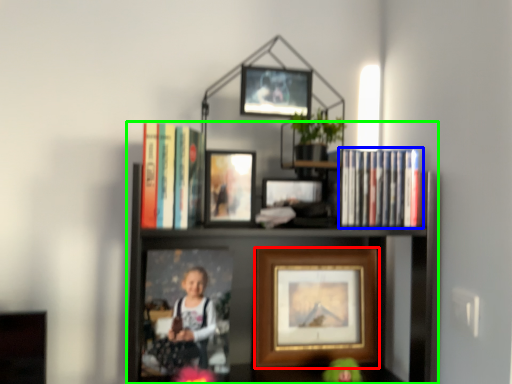
Question: Estimate the real-world distances between objects in this image. Which object is closer to picture frame (highlighted by a red box), book (highlighted by a blue box) or shelf (highlighted by a green box)?

Choices:
 (A) book
 (B) shelf

Answer: (B)